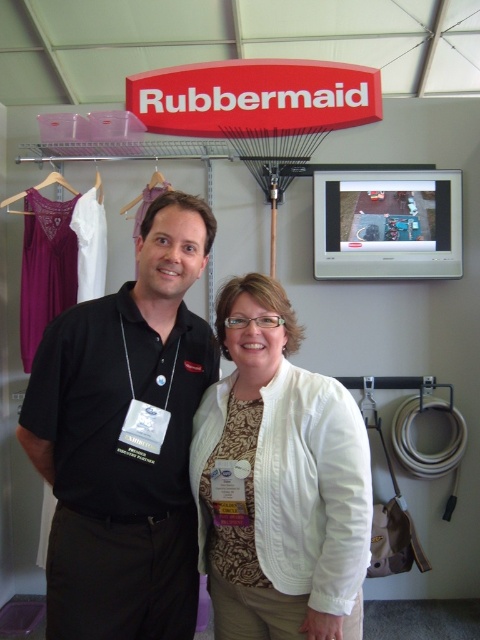
You are a person who is 1.7 meters tall and want to hang your white cotton jacket at center on the purple fabric hanger at upper left. Can you reach the hanger?

The white cotton jacket at center is 1.67 meters from the purple fabric hanger at upper left. Since the person is 1.7 meters tall, they can likely reach the hanger as the distance is slightly less than their height.

You are at the Rubbermaid booth and need to locate the white cotton jacket at center and the purple fabric hanger at upper left. According to the scene description, which object is positioned to the right of the other?

The white cotton jacket at center is to the right of the purple fabric hanger at upper left.